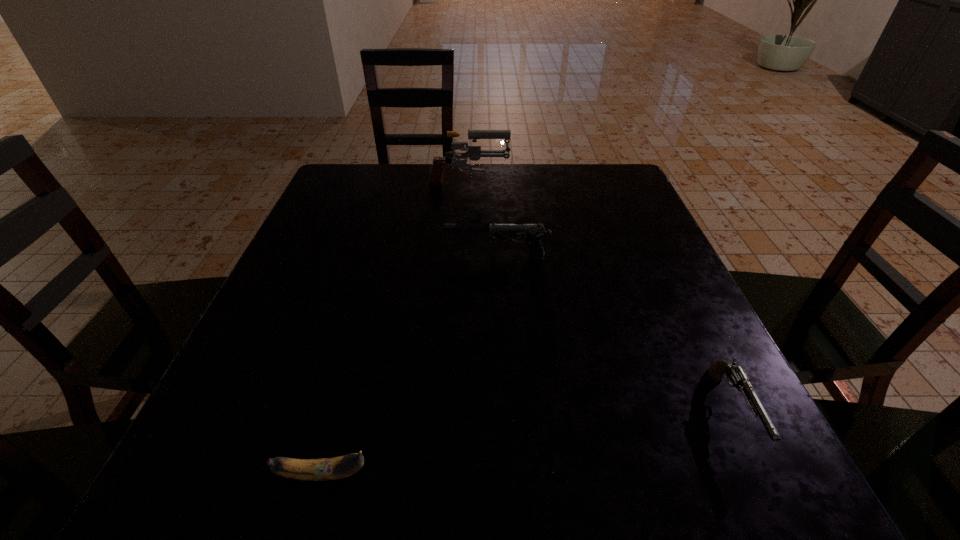
At what (x,y) coordinates should I click in order to perform the action: click on the farthest object. Please return your answer as a coordinate pair (x, y). Image resolution: width=960 pixels, height=540 pixels. Looking at the image, I should click on (474, 153).

The height and width of the screenshot is (540, 960). Identify the location of the tallest object. (474, 153).

Where is `the third nearest object`? the third nearest object is located at coordinates (534, 232).

Locate an element on the screen. the second tallest object is located at coordinates (534, 232).

Identify the location of the nearest object. The width and height of the screenshot is (960, 540). (340, 467).

Where is `the leftmost object`? The image size is (960, 540). the leftmost object is located at coordinates (340, 467).

Locate an element on the screen. The height and width of the screenshot is (540, 960). the nearest gun is located at coordinates (735, 373).

The image size is (960, 540). In order to click on the rightmost gun in this screenshot , I will do `click(735, 373)`.

This screenshot has height=540, width=960. I want to click on vacant region located at the barrel end of the farthest gun, so click(x=602, y=187).

Where is `vacant space positioned at the muzzle end of the second tallest object`? The image size is (960, 540). vacant space positioned at the muzzle end of the second tallest object is located at coordinates (402, 256).